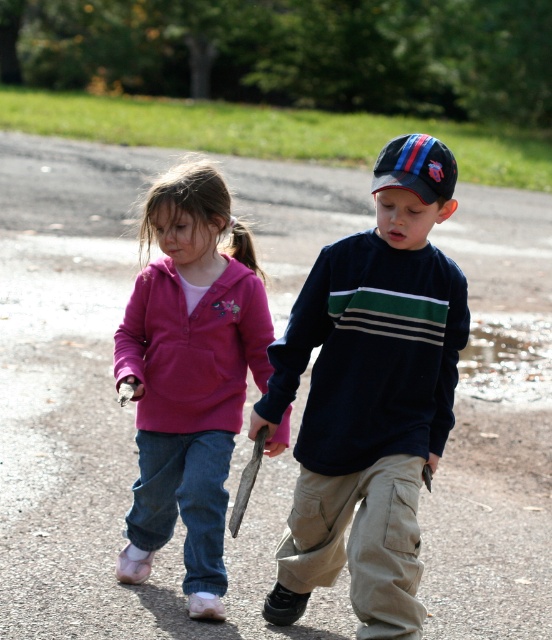
Which of these two, pink fleece jacket at left or glistening water at puddle right, stands taller?

pink fleece jacket at left

Does pink fleece jacket at left have a lesser width compared to glistening water at puddle right?

Indeed, pink fleece jacket at left has a lesser width compared to glistening water at puddle right.

Locate an element on the screen. This screenshot has height=640, width=552. pink fleece jacket at left is located at coordinates (189, 376).

I want to click on pink fleece jacket at left, so click(x=189, y=376).

Is dark blue cotton shirt at center closer to camera compared to pink fleece jacket at left?

Yes, it is.

You are a GUI agent. You are given a task and a screenshot of the screen. Output one action in this format:
    pyautogui.click(x=<x>, y=<y>)
    Task: Click on the dark blue cotton shirt at center
    The width and height of the screenshot is (552, 640).
    Given the screenshot: What is the action you would take?
    pyautogui.click(x=370, y=396)

Is dark blue cotton shirt at center smaller than glistening water at puddle right?

Indeed, dark blue cotton shirt at center has a smaller size compared to glistening water at puddle right.

Between point (392, 189) and point (538, 358), which one is positioned in front?

Positioned in front is point (392, 189).

The height and width of the screenshot is (640, 552). I want to click on dark blue cotton shirt at center, so click(370, 396).